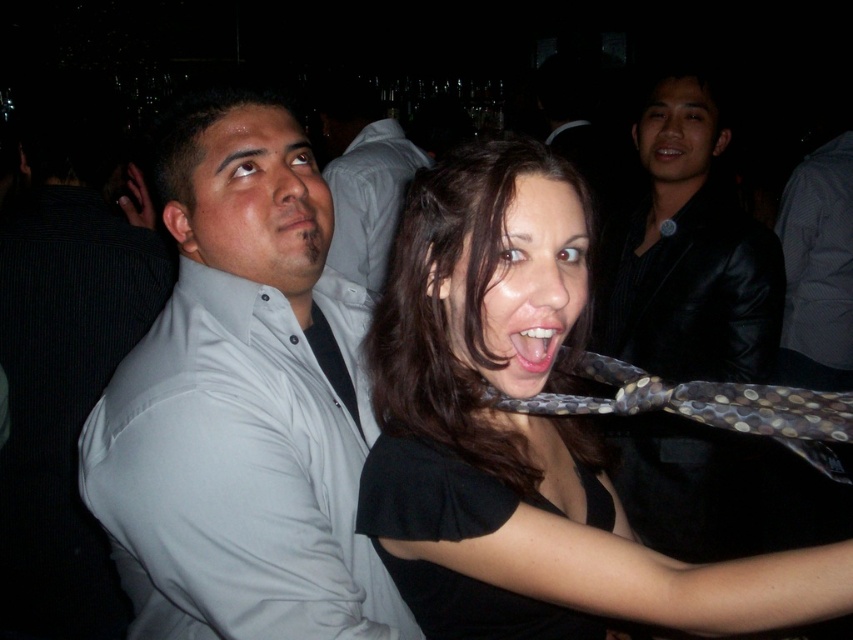
You are a photographer adjusting your camera settings to focus on the polka dot fabric tie at center and the matte white shirt at upper center. Since the lighting is dim, you need to ensure both subjects are properly illuminated. Given their positions, which one might require more light adjustment to avoid appearing too dark?

The polka dot fabric tie at center has a lesser height compared to the matte white shirt at upper center. Since it is lower in position, it might be in a darker area of the image and thus require more light adjustment to ensure proper exposure.

In the described scene, there are two people in the foreground. The man on the left is wearing a light colored long sleeved shirt with a black undershirt visible at the collar. The woman to his right has shoulder length dark hair. A point at coordinates (242, 401) is present in the image. Which object does this point correspond to?

The point at coordinates (242, 401) corresponds to the white matte shirt at left.

Looking at this image, you are a photographer at this event. You need to capture a photo that includes both the white matte shirt at left and the smooth white teeth at center. Which object should you adjust your camera focus to first to ensure both are in frame?

The white matte shirt at left is wider than the smooth white teeth at center, so you should focus on the white matte shirt at left first to ensure both fit within the camera frame.